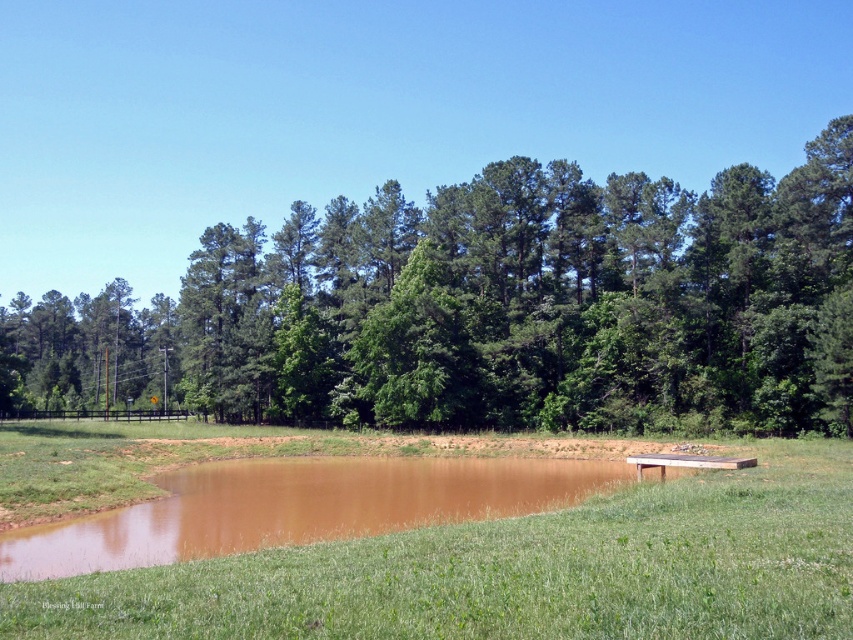
Can you confirm if green leafy tree at center is taller than green grass at lower center?

Yes.

Who is positioned more to the left, green leafy tree at center or green grass at lower center?

green leafy tree at center

Identify the location of green leafy tree at center. This screenshot has width=853, height=640. coord(489,308).